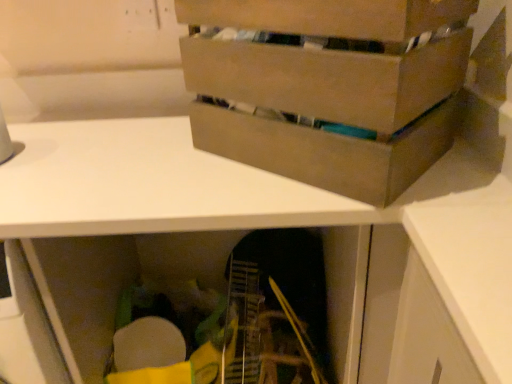
Question: In terms of height, does white matte desk at center look taller or shorter compared to brown cardboard box at upper center?

Choices:
 (A) short
 (B) tall

Answer: (B)

Question: Is white matte desk at center bigger or smaller than brown cardboard box at upper center?

Choices:
 (A) small
 (B) big

Answer: (B)

Question: In terms of width, does white matte desk at center look wider or thinner when compared to brown cardboard box at upper center?

Choices:
 (A) wide
 (B) thin

Answer: (A)

Question: Considering the positions of brown cardboard box at upper center and white matte desk at center in the image, is brown cardboard box at upper center taller or shorter than white matte desk at center?

Choices:
 (A) short
 (B) tall

Answer: (A)

Question: From the image's perspective, relative to white matte desk at center, is brown cardboard box at upper center above or below?

Choices:
 (A) above
 (B) below

Answer: (A)

Question: Considering the positions of brown cardboard box at upper center and white matte desk at center in the image, is brown cardboard box at upper center wider or thinner than white matte desk at center?

Choices:
 (A) wide
 (B) thin

Answer: (B)

Question: Relative to white matte desk at center, is brown cardboard box at upper center in front or behind?

Choices:
 (A) front
 (B) behind

Answer: (A)